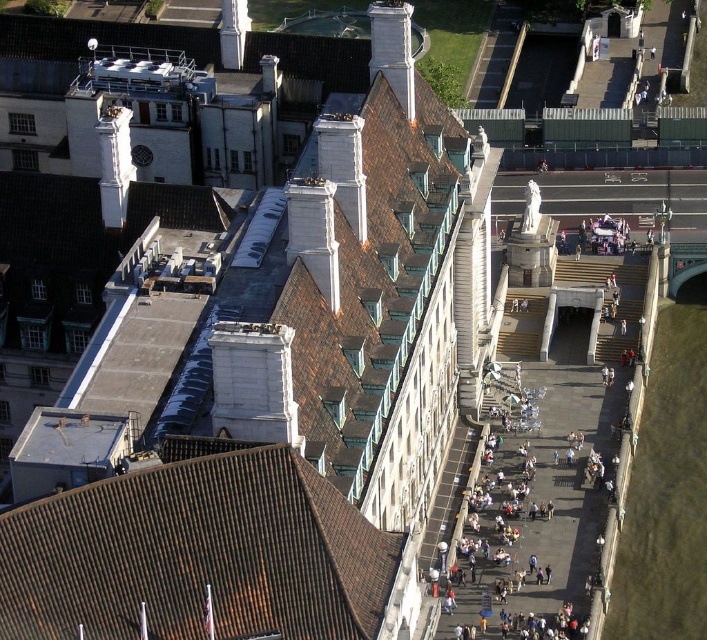
You are a drone operator trying to capture a photo of the brown tile roof at lower left and the white stone chimney at upper center. Which object should you focus on first to ensure both are in the frame without moving the drone?

You should focus on the brown tile roof at lower left first because it is closer to the viewer than the white stone chimney at upper center, so adjusting the focus starting from the closer object ensures both are in the frame.